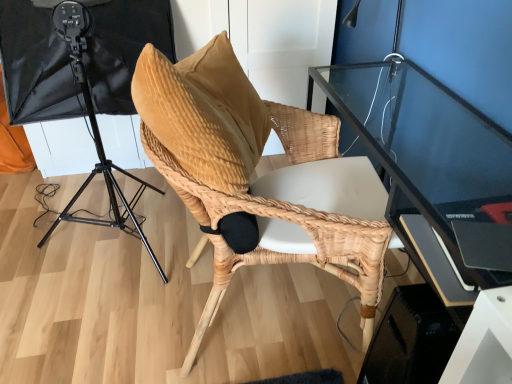
This screenshot has height=384, width=512. Find the location of `free point to the left of natural woven chair at center`. free point to the left of natural woven chair at center is located at coordinates (106, 334).